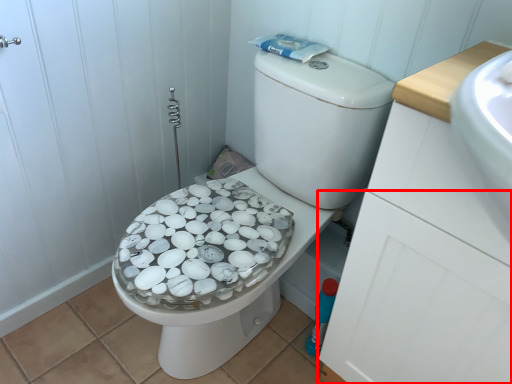
Question: From the image's perspective, where is drawer (annotated by the red box) located relative to bidet?

Choices:
 (A) below
 (B) above

Answer: (B)